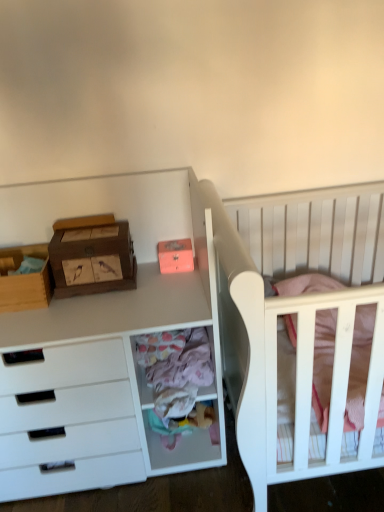
Question: From the image's perspective, is wooden with bird designs at left positioned above or below wooden chest of drawers at left?

Choices:
 (A) above
 (B) below

Answer: (A)

Question: From a real-world perspective, is wooden with bird designs at left positioned above or below wooden chest of drawers at left?

Choices:
 (A) below
 (B) above

Answer: (B)

Question: Estimate the real-world distances between objects in this image. Which object is farther from the wooden chest of drawers at left?

Choices:
 (A) pastel fabric drawer at center
 (B) white wood crib at right
 (C) wooden with bird designs at left
 (D) matte orange storage box at upper center, which appears as the second storage box when viewed from the left
 (E) wooden storage box at left, arranged as the 1th storage box when viewed from the left

Answer: (B)

Question: Which of these objects is positioned farthest from the wooden storage box at left, acting as the 2th storage box starting from the right?

Choices:
 (A) white wood crib at right
 (B) wooden with bird designs at left
 (C) pastel fabric drawer at center
 (D) wooden chest of drawers at left
 (E) matte orange storage box at upper center, the 1th storage box viewed from the right

Answer: (A)